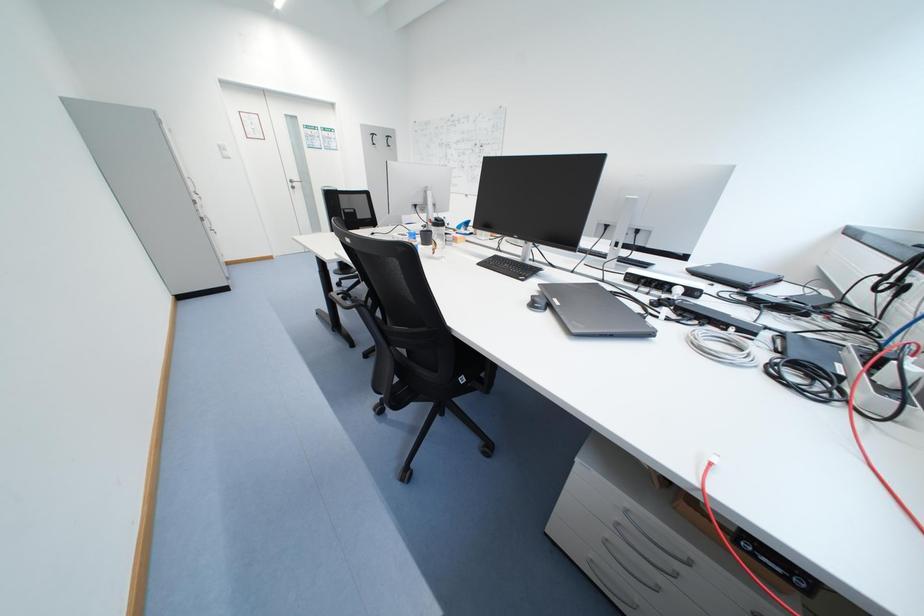
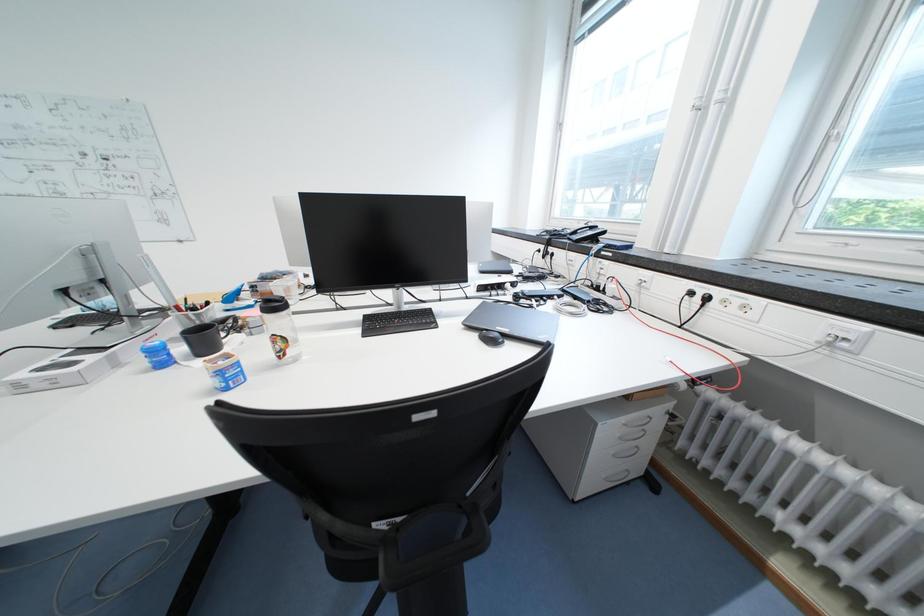
Question: How did the camera likely rotate?

Choices:
 (A) Left
 (B) Right
 (C) Up
 (D) Down

Answer: (B)